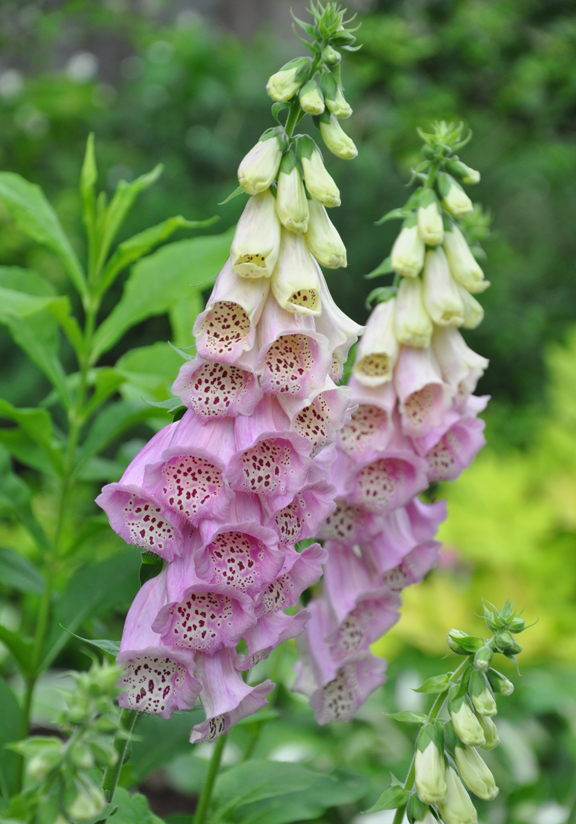
At what (x,y) coordinates should I click in order to perform the action: click on smaller plant. Please return your answer as a coordinate pair (x, y). Looking at the image, I should click on (430, 727).